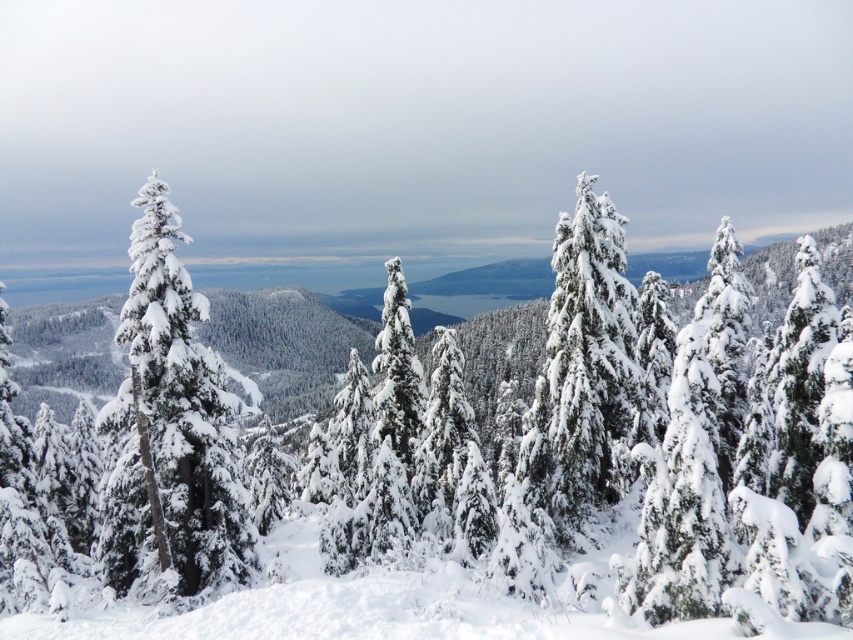
Is snow-covered evergreen at center positioned in front of snow-covered evergreen at left?

Yes, snow-covered evergreen at center is closer to the viewer.

Does snow-covered evergreen at center appear over snow-covered evergreen at left?

Indeed, snow-covered evergreen at center is positioned over snow-covered evergreen at left.

Is point (399, 484) positioned in front of point (207, 486)?

No, it is not.

At what (x,y) coordinates should I click in order to perform the action: click on snow-covered evergreen at center. Please return your answer as a coordinate pair (x, y). This screenshot has height=640, width=853. Looking at the image, I should click on (723, 524).